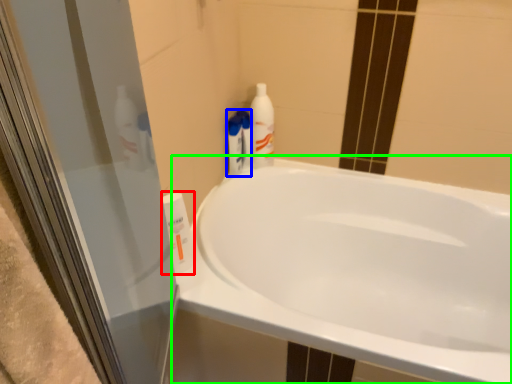
Question: Considering the real-world distances, which object is farthest from cleaning product (highlighted by a red box)? cleaning product (highlighted by a blue box) or bathtub (highlighted by a green box)?

Choices:
 (A) cleaning product
 (B) bathtub

Answer: (B)